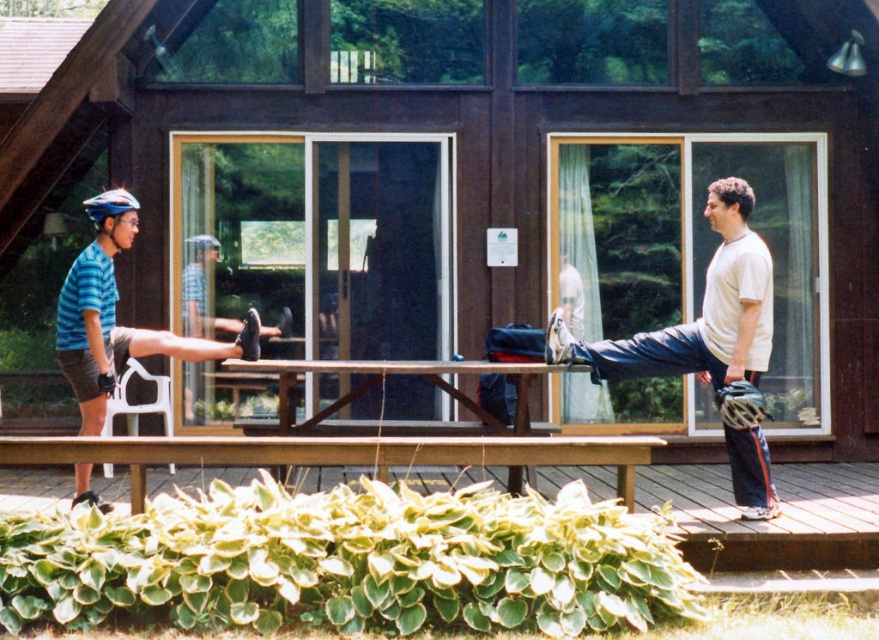
Question: Which of the following is the farthest from the observer?

Choices:
 (A) green leafy plant at lower center
 (B) wooden bench at lower center

Answer: (B)

Question: Does wooden bench at lower center appear on the left side of white matte helmet at upper right?

Choices:
 (A) no
 (B) yes

Answer: (A)

Question: Where is blue helmeted skateboarder at left located in relation to wooden picnic table at center in the image?

Choices:
 (A) above
 (B) below

Answer: (A)

Question: Which object appears closest to the camera in this image?

Choices:
 (A) white matte helmet at upper right
 (B) wooden picnic table at center
 (C) green leafy plant at lower center

Answer: (C)

Question: Which object appears farthest from the camera in this image?

Choices:
 (A) wooden bench at lower center
 (B) white matte helmet at upper right

Answer: (B)

Question: Does wooden bench at lower center appear over blue helmeted skateboarder at left?

Choices:
 (A) yes
 (B) no

Answer: (B)